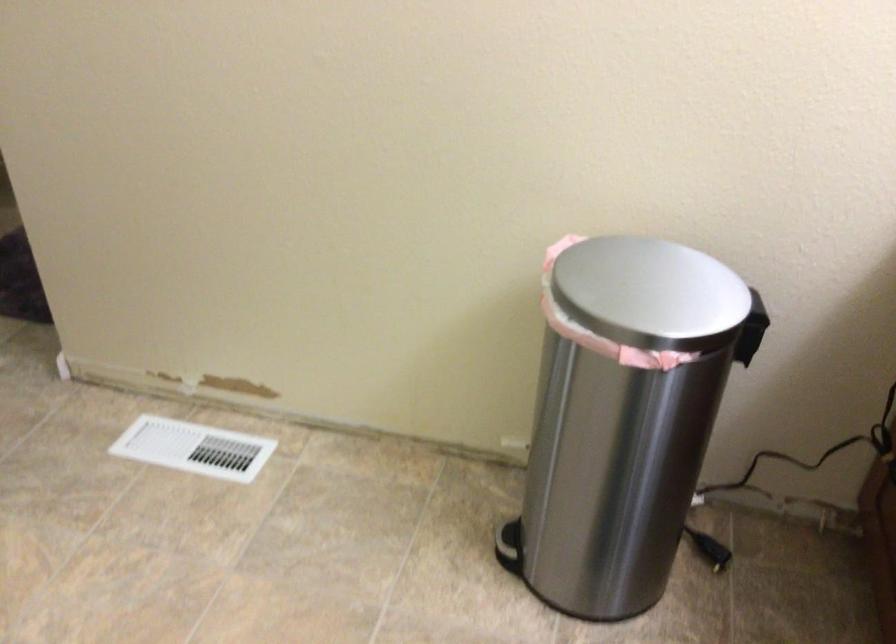
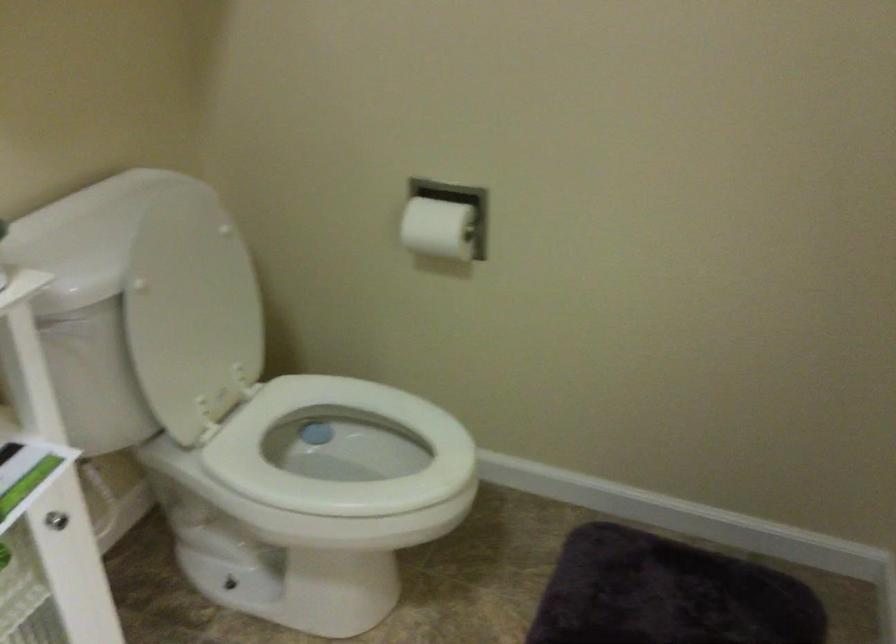
What movement of the cameraman would produce the second image?

The cameraman moved toward left, forward.